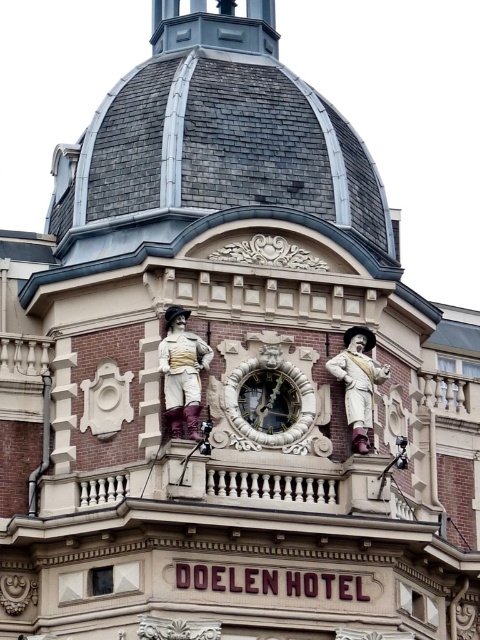
You are an architect designing a new building and want to place a 1.2 meter wide decorative item on the facade. You have two options from the image, the matte gold statue at center and the wooden statue at center. Which statue would allow the decorative item to fit without exceeding the width constraint?

The matte gold statue at center has a width less than the wooden statue at center, so the matte gold statue at center would allow the decorative item to fit within the 1.2 meter width constraint if its width is under 1.2 meters.

You are an architect examining the building from the ground. You notice two points marked on the building facade. The first point is at coordinates point (x=187, y=420) and the second is at point (x=360, y=376). Which point is closer to your viewpoint?

Point (x=187, y=420) is closer to the viewer than point (x=360, y=376).